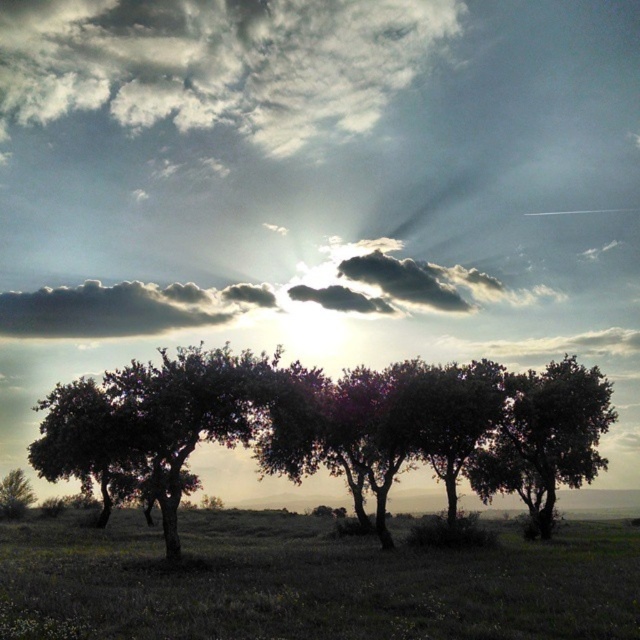
Question: Estimate the real-world distances between objects in this image. Which object is farther from the silhouette leafy tree at center?

Choices:
 (A) green leafy tree at center
 (B) smokey gray cloud at upper center
 (C) green matte tree at lower left
 (D) white fluffy cloud at upper center

Answer: (D)

Question: Among these objects, which one is farthest from the camera?

Choices:
 (A) green leafy tree at left
 (B) dark gray fluffy cloud at upper left

Answer: (B)

Question: Does green leafy tree at left lie behind smokey gray cloud at upper center?

Choices:
 (A) no
 (B) yes

Answer: (A)

Question: Does green leafy tree at left have a greater width compared to green leafy tree at center?

Choices:
 (A) no
 (B) yes

Answer: (B)

Question: Which object appears farthest from the camera in this image?

Choices:
 (A) smokey gray cloud at upper center
 (B) green grassy at lower center

Answer: (A)

Question: Does green leafy tree at center appear under green matte tree at lower left?

Choices:
 (A) no
 (B) yes

Answer: (A)